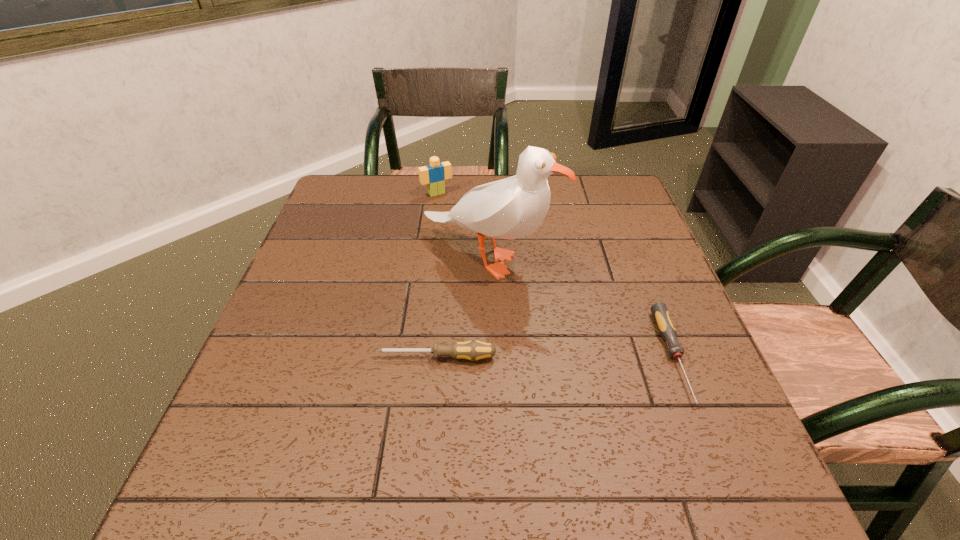
Find the location of a particular element. free space on the desktop that is between the second shortest object and the shortest object and is positioned on the face of the farthest object is located at coordinates (553, 357).

I want to click on free spot on the desktop that is between the taller screwdriver and the shortest object and is positioned at the beak of the tallest object, so click(579, 357).